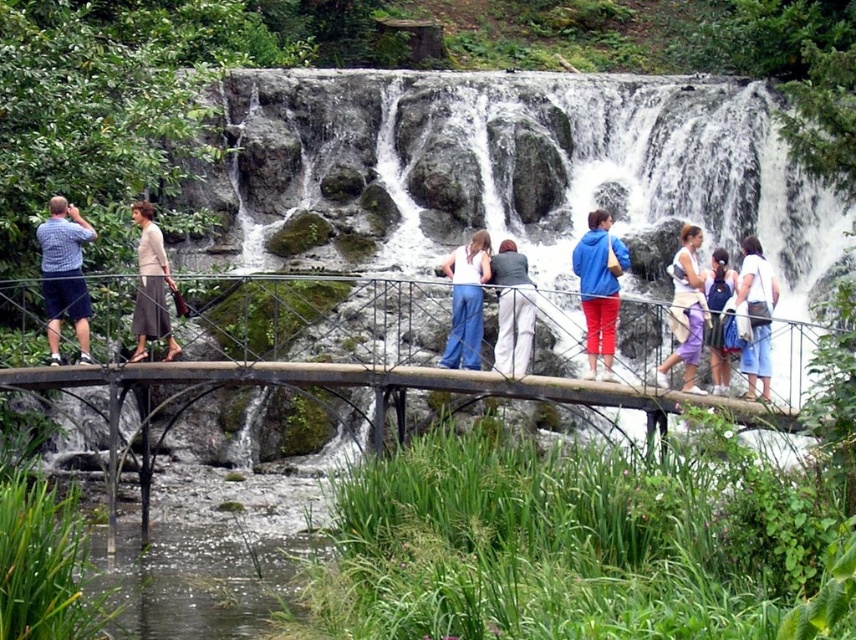
Question: Does white cotton dress at center appear on the right side of white cotton shirt at center?

Choices:
 (A) yes
 (B) no

Answer: (B)

Question: Considering the real-world distances, which object is farthest from the wooden bridge at center?

Choices:
 (A) white cotton shirt at center
 (B) matte gray jacket at center
 (C) green grassy creek at lower left

Answer: (A)

Question: Which object is positioned closest to the matte gray skirt at left?

Choices:
 (A) blue matte jacket at center
 (B) green grassy creek at lower left
 (C) denim skirt at center

Answer: (B)

Question: From the image, what is the correct spatial relationship of wooden bridge at center in relation to green grassy creek at lower left?

Choices:
 (A) right
 (B) left

Answer: (A)

Question: Is the position of white cotton dress at center less distant than that of denim skirt at center?

Choices:
 (A) yes
 (B) no

Answer: (A)

Question: Which object appears closest to the camera in this image?

Choices:
 (A) white cotton shirt at center
 (B) white cotton dress at center

Answer: (A)